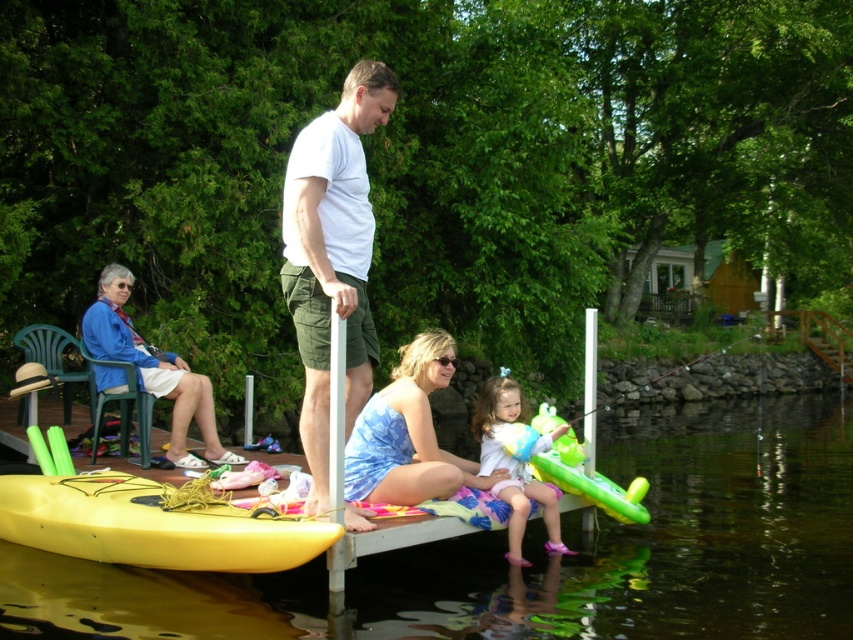
You are a swimmer preparing to jump into the water. You see the transparent plastic water at lower center and the blue fabric shirt at upper left. Which object is closer to the surface of the water?

The transparent plastic water at lower center is closer to the surface of the water because it is shorter than the blue fabric shirt at upper left.